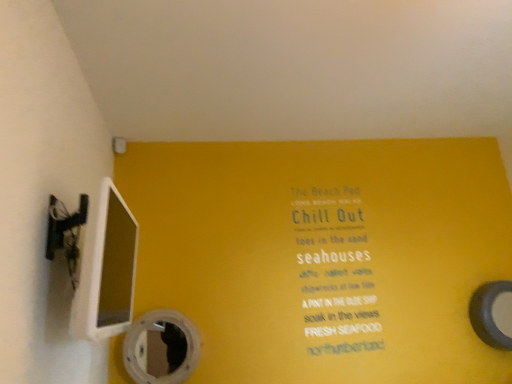
Question: Should I look upward or downward to see transparent plastic mirror at lower center, which is the 2th mirror from back to front?

Choices:
 (A) up
 (B) down

Answer: (B)

Question: Can you confirm if transparent plastic mirror at lower center, the first mirror from the front, is smaller than smooth gray mirror at right, placed as the second mirror when sorted from front to back?

Choices:
 (A) yes
 (B) no

Answer: (B)

Question: From a real-world perspective, is transparent plastic mirror at lower center, the first mirror from the front, on smooth gray mirror at right, arranged as the second mirror when viewed from the left?

Choices:
 (A) no
 (B) yes

Answer: (A)

Question: From a real-world perspective, is transparent plastic mirror at lower center, the first mirror from the front, positioned under smooth gray mirror at right, which is counted as the first mirror, starting from the right, based on gravity?

Choices:
 (A) no
 (B) yes

Answer: (B)

Question: Does transparent plastic mirror at lower center, the 1th mirror in the left-to-right sequence, appear on the left side of smooth gray mirror at right, placed as the second mirror when sorted from front to back?

Choices:
 (A) yes
 (B) no

Answer: (A)

Question: From the image's perspective, does transparent plastic mirror at lower center, the first mirror from the front, appear lower than smooth gray mirror at right, which is counted as the first mirror, starting from the right?

Choices:
 (A) yes
 (B) no

Answer: (A)

Question: Would you say transparent plastic mirror at lower center, which is the second mirror from right to left, is outside smooth gray mirror at right, arranged as the second mirror when viewed from the left?

Choices:
 (A) no
 (B) yes

Answer: (B)

Question: Are smooth gray mirror at right, acting as the 1th mirror starting from the back, and transparent plastic mirror at lower center, which is the second mirror from right to left, making contact?

Choices:
 (A) yes
 (B) no

Answer: (B)

Question: Is smooth gray mirror at right, placed as the second mirror when sorted from front to back, facing towards transparent plastic mirror at lower center, which is the second mirror from right to left?

Choices:
 (A) yes
 (B) no

Answer: (B)

Question: Considering the relative sizes of smooth gray mirror at right, placed as the second mirror when sorted from front to back, and transparent plastic mirror at lower center, which is the 2th mirror from back to front, in the image provided, is smooth gray mirror at right, placed as the second mirror when sorted from front to back, taller than transparent plastic mirror at lower center, which is the 2th mirror from back to front,?

Choices:
 (A) yes
 (B) no

Answer: (A)

Question: Can you confirm if smooth gray mirror at right, placed as the second mirror when sorted from front to back, is smaller than transparent plastic mirror at lower center, which is the second mirror from right to left?

Choices:
 (A) yes
 (B) no

Answer: (A)

Question: Does smooth gray mirror at right, placed as the second mirror when sorted from front to back, contain transparent plastic mirror at lower center, which is the 2th mirror from back to front?

Choices:
 (A) yes
 (B) no

Answer: (B)

Question: Can you confirm if smooth gray mirror at right, acting as the 1th mirror starting from the back, is shorter than transparent plastic mirror at lower center, the 1th mirror in the left-to-right sequence?

Choices:
 (A) yes
 (B) no

Answer: (B)

Question: From a real-world perspective, is smooth gray mirror at right, arranged as the second mirror when viewed from the left, physically located above or below transparent plastic mirror at lower center, which is the second mirror from right to left?

Choices:
 (A) above
 (B) below

Answer: (A)